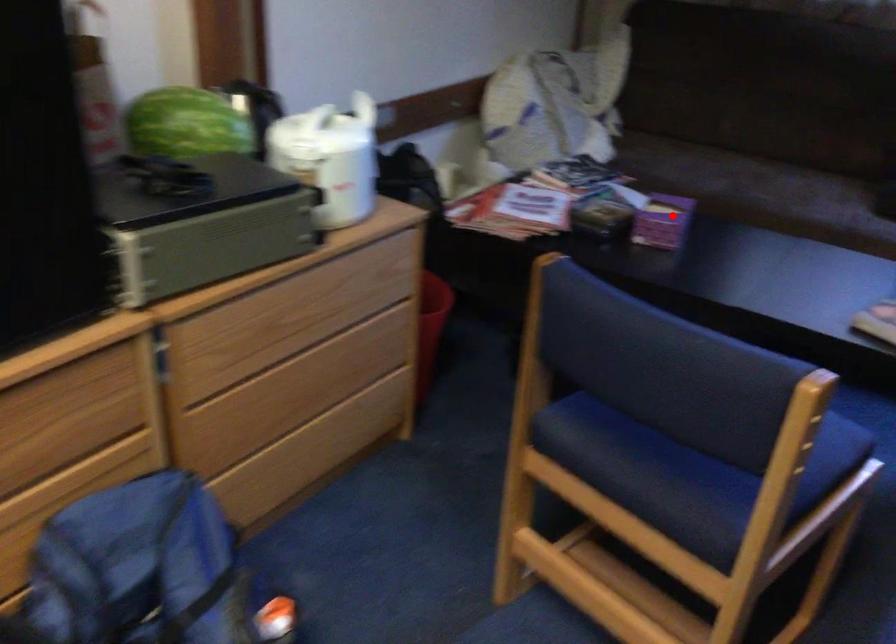
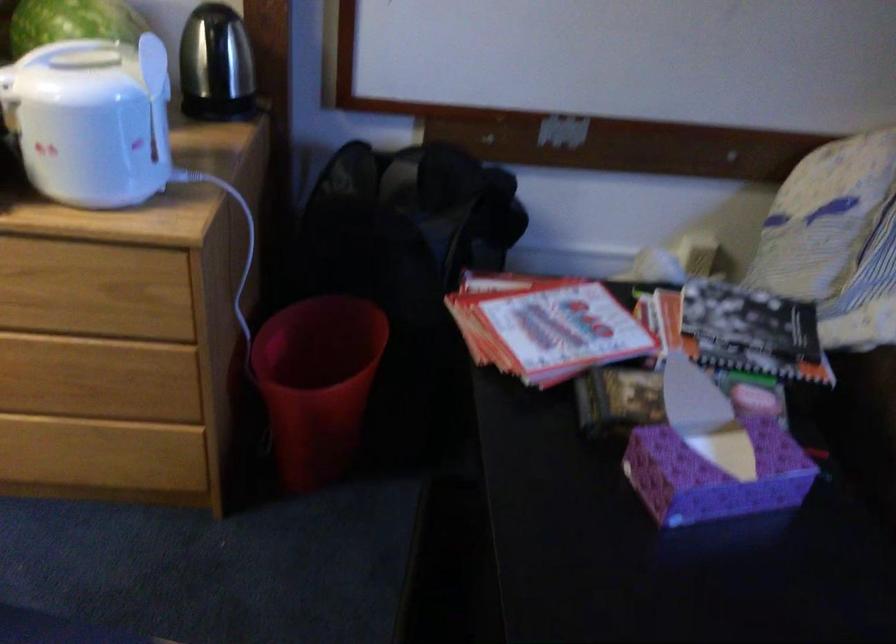
Question: I am providing you with two images of the same scene from different viewpoints. A red point is marked on the first image. Is the red point's position out of view in image 2?

Choices:
 (A) Yes
 (B) No

Answer: (B)